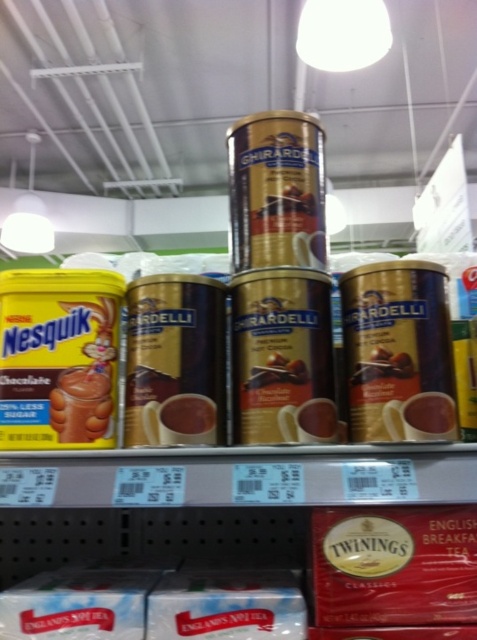
Question: Does yellow matte nesquik chocolate at left come in front of gold metallic canister at center?

Choices:
 (A) no
 (B) yes

Answer: (A)

Question: Which point appears farthest from the camera in this image?

Choices:
 (A) (12, 364)
 (B) (197, 604)

Answer: (A)

Question: Can you confirm if metallic gold canister at center is positioned to the right of white paper english tea at lower center?

Choices:
 (A) yes
 (B) no

Answer: (B)

Question: Which of the following is the farthest from the observer?

Choices:
 (A) shiny metallic canister at center
 (B) white paper english tea at lower center
 (C) gold metallic canister at center
 (D) yellow matte nesquik chocolate at left

Answer: (A)

Question: In this image, where is metallic gold canister at center-right located relative to metallic gold canister at center?

Choices:
 (A) above
 (B) below

Answer: (A)

Question: Which point is farther from the camera taking this photo?

Choices:
 (A) coord(76,326)
 (B) coord(417,588)

Answer: (A)